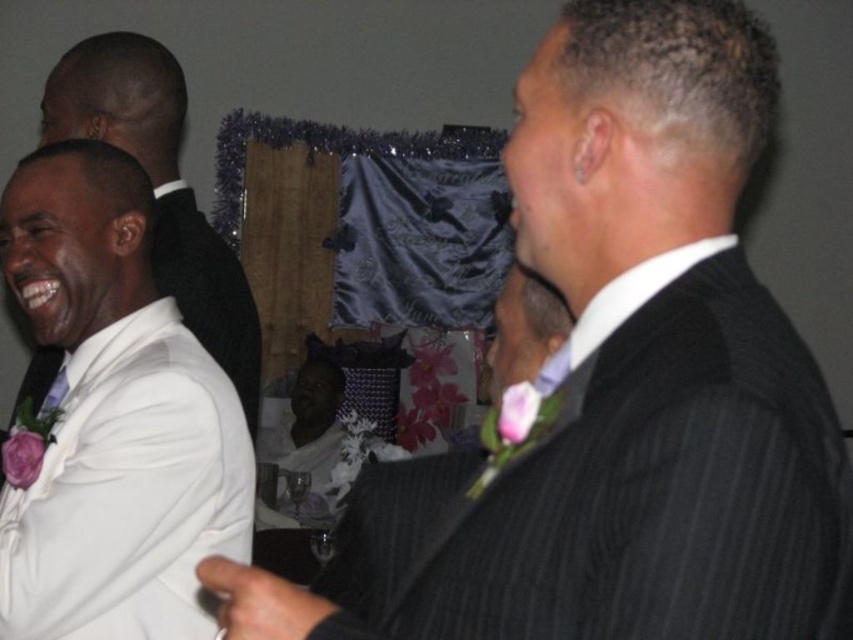
Question: Which of the following is the closest to the observer?

Choices:
 (A) (53, 396)
 (B) (218, 524)
 (C) (171, 161)

Answer: (B)

Question: Which of these objects is positioned closest to the matte white tie at left?

Choices:
 (A) matte black suit at center
 (B) white satin suit at left
 (C) white satin shirt at left

Answer: (C)

Question: Which point is closer to the camera?

Choices:
 (A) white satin suit at left
 (B) matte black suit at center
 (C) white satin shirt at left
 (D) matte white tie at left

Answer: (C)

Question: Can you confirm if white satin suit at left is wider than matte white tie at left?

Choices:
 (A) yes
 (B) no

Answer: (A)

Question: Does white satin shirt at left have a larger size compared to matte white tie at left?

Choices:
 (A) no
 (B) yes

Answer: (B)

Question: Where is white satin shirt at left located in relation to white satin suit at left in the image?

Choices:
 (A) left
 (B) right

Answer: (B)